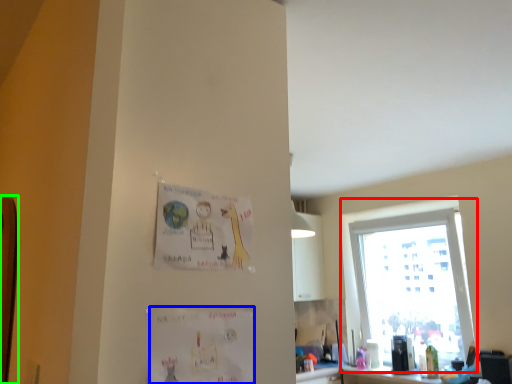
Question: Based on their relative distances, which object is farther from window (highlighted by a red box)? Choose from postcard (highlighted by a blue box) and bulletin board (highlighted by a green box).

Choices:
 (A) postcard
 (B) bulletin board

Answer: (B)